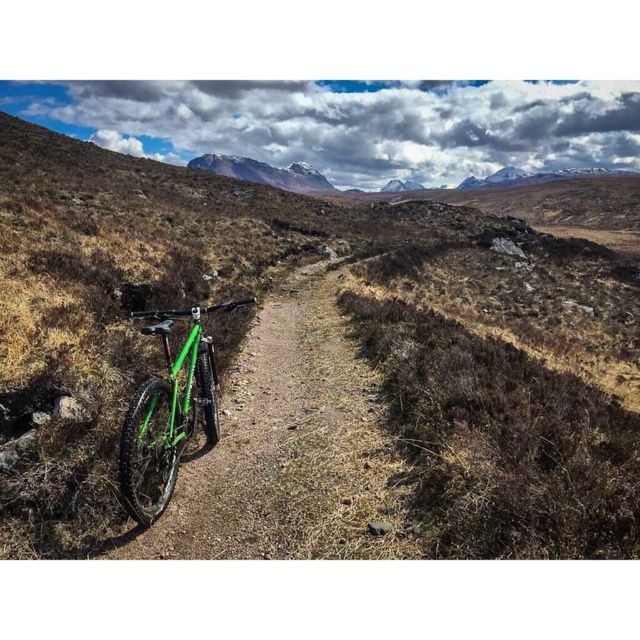
You are standing at the green mountain bike in the foreground and want to walk towards the distant mountain peaks. Which point, point [179,387] or point [300,186], is closer to your current position?

Point [179,387] is closer to the viewer than point [300,186], so it is closer to your current position at the green mountain bike.

You are a hiker who just arrived at the trailhead and see the green matte bicycle at left and the green matte mountain bike at center. Which one is positioned more to the left?

The green matte mountain bike at center is positioned more to the left than the green matte bicycle at left.